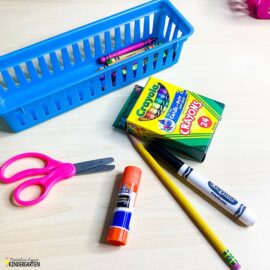
Where is `counter top`? counter top is located at coordinates (249, 98).